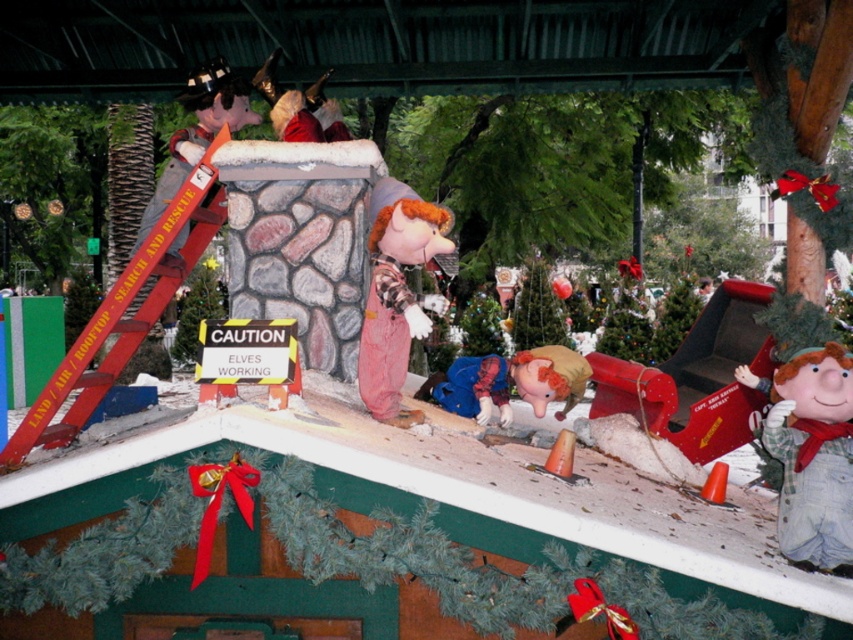
Question: Which object is closer to the camera taking this photo?

Choices:
 (A) flannel shirt overalls at center
 (B) red metal ladder at upper left

Answer: (A)

Question: Considering the relative positions of flannel shirt at lower right and flannel shirt overalls at center in the image provided, where is flannel shirt at lower right located with respect to flannel shirt overalls at center?

Choices:
 (A) below
 (B) above

Answer: (A)

Question: Can you confirm if flannel shirt at lower right is thinner than red metal ladder at upper left?

Choices:
 (A) no
 (B) yes

Answer: (B)

Question: Which of the following is the farthest from the observer?

Choices:
 (A) (440, 376)
 (B) (392, 344)

Answer: (A)

Question: Is the position of flannel shirt at lower right more distant than that of shiny silver helmet at upper left?

Choices:
 (A) no
 (B) yes

Answer: (A)

Question: Which of the following is the farthest from the observer?

Choices:
 (A) (123, 304)
 (B) (566, 355)
 (C) (827, 534)

Answer: (B)